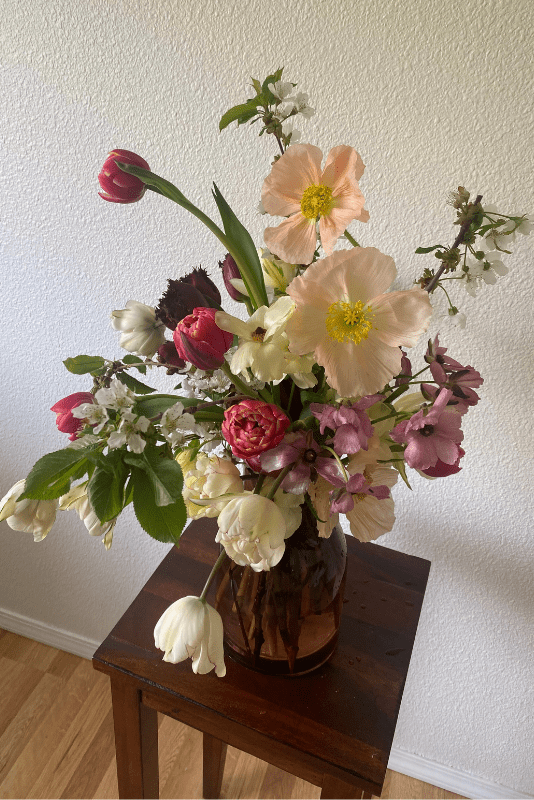
Locate an element on the screen. Image resolution: width=534 pixels, height=800 pixels. wooden floor is located at coordinates (21, 714), (92, 750), (182, 766), (270, 784), (407, 790).